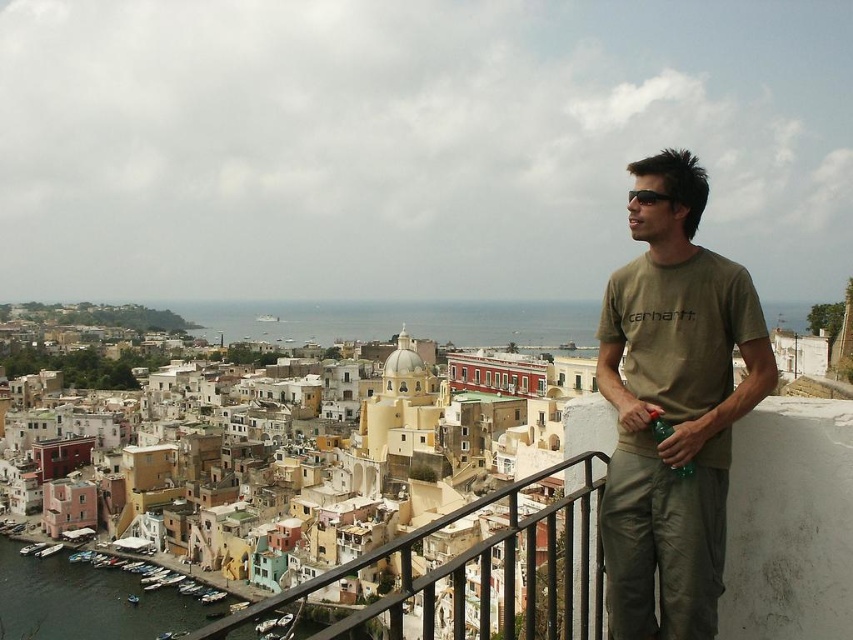
Who is positioned more to the left, matte khaki t-shirt at right or black metal railing at lower center?

Positioned to the left is black metal railing at lower center.

Which of these two, matte khaki t-shirt at right or black metal railing at lower center, stands taller?

black metal railing at lower center

Is point (682, 545) positioned in front of point (486, 609)?

Yes, point (682, 545) is in front of point (486, 609).

Identify the location of matte khaki t-shirt at right. This screenshot has height=640, width=853. (672, 404).